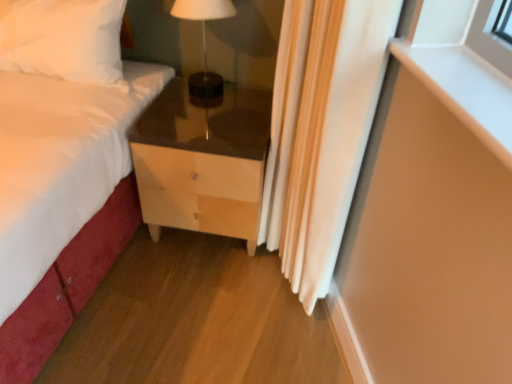
Where is `free location to the left of white fabric curtain at right`? free location to the left of white fabric curtain at right is located at coordinates (202, 289).